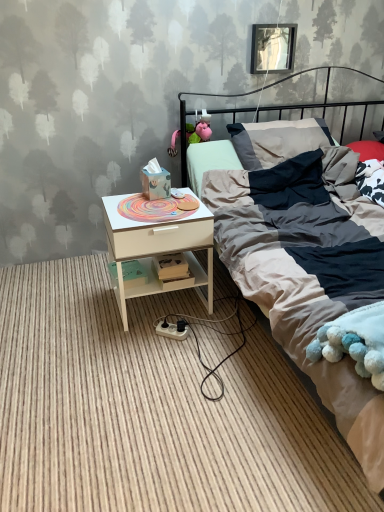
Where is `free point above white wood nightstand at lower left (from a real-world perspective)`? The image size is (384, 512). free point above white wood nightstand at lower left (from a real-world perspective) is located at coordinates (173, 199).